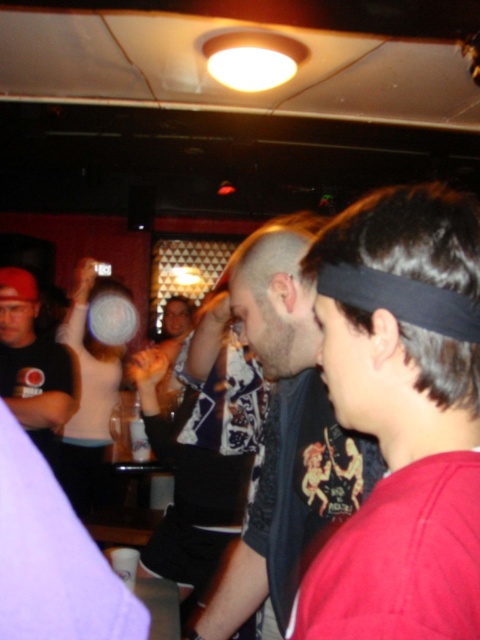
Question: From the image, what is the correct spatial relationship of dark gray t-shirt at center in relation to matte black t-shirt at left?

Choices:
 (A) left
 (B) right

Answer: (B)

Question: Observing the image, what is the correct spatial positioning of dark gray t-shirt at center in reference to matte black t-shirt at left?

Choices:
 (A) right
 (B) left

Answer: (A)

Question: Does dark gray t-shirt at center appear on the right side of matte black t-shirt at left?

Choices:
 (A) no
 (B) yes

Answer: (B)

Question: Which object is closer to the camera taking this photo?

Choices:
 (A) matte black t-shirt at left
 (B) dark gray t-shirt at center

Answer: (B)